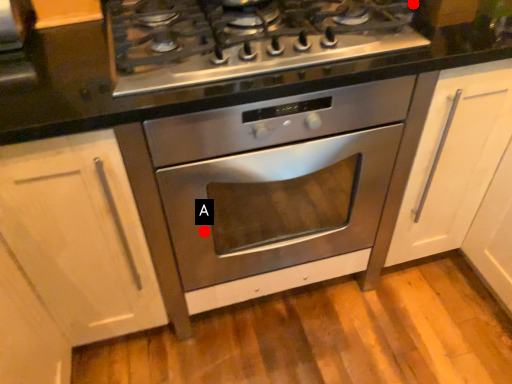
Question: Two points are circled on the image, labeled by A and B beside each circle. Which point appears closest to the camera in this image?

Choices:
 (A) A is closer
 (B) B is closer

Answer: (A)